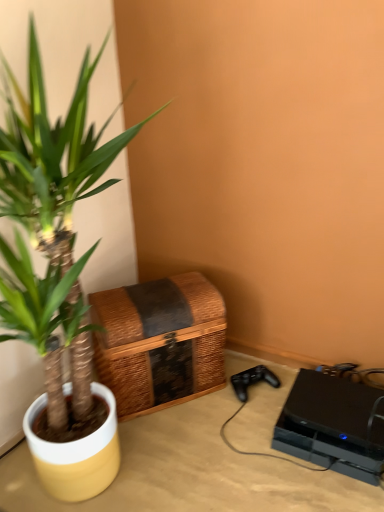
Question: Is woven brown basket at lower left touching beige wood table at lower right?

Choices:
 (A) yes
 (B) no

Answer: (B)

Question: Is beige wood table at lower right surrounded by woven brown basket at lower left?

Choices:
 (A) yes
 (B) no

Answer: (B)

Question: Considering the relative sizes of woven brown basket at lower left and beige wood table at lower right in the image provided, is woven brown basket at lower left shorter than beige wood table at lower right?

Choices:
 (A) no
 (B) yes

Answer: (A)

Question: Does woven brown basket at lower left have a larger size compared to beige wood table at lower right?

Choices:
 (A) yes
 (B) no

Answer: (B)

Question: Considering the relative sizes of woven brown basket at lower left and beige wood table at lower right in the image provided, is woven brown basket at lower left taller than beige wood table at lower right?

Choices:
 (A) no
 (B) yes

Answer: (B)

Question: Is woven brown basket at lower left closer to the viewer compared to beige wood table at lower right?

Choices:
 (A) yes
 (B) no

Answer: (B)

Question: Can you confirm if green leafy plant at left is positioned to the right of woven brown basket at lower left?

Choices:
 (A) yes
 (B) no

Answer: (B)

Question: Considering the relative sizes of green leafy plant at left and woven brown basket at lower left in the image provided, is green leafy plant at left thinner than woven brown basket at lower left?

Choices:
 (A) yes
 (B) no

Answer: (B)

Question: Is the depth of green leafy plant at left greater than that of woven brown basket at lower left?

Choices:
 (A) no
 (B) yes

Answer: (A)

Question: Can you confirm if green leafy plant at left is smaller than woven brown basket at lower left?

Choices:
 (A) no
 (B) yes

Answer: (A)

Question: Is woven brown basket at lower left completely or partially inside green leafy plant at left?

Choices:
 (A) yes
 (B) no

Answer: (B)

Question: Is green leafy plant at left located outside woven brown basket at lower left?

Choices:
 (A) no
 (B) yes

Answer: (B)

Question: From the image's perspective, is beige wood table at lower right on top of green leafy plant at left?

Choices:
 (A) yes
 (B) no

Answer: (B)